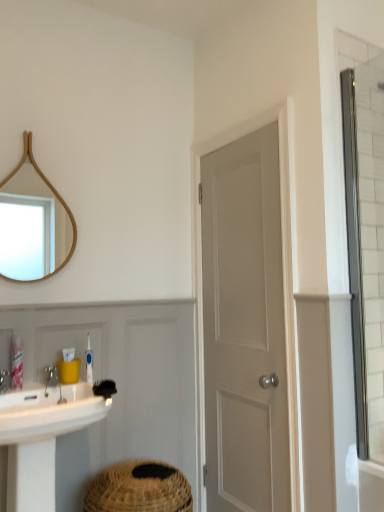
Question: From the image's perspective, is yellow plastic container at sink, the 2th toiletry from the left, located beneath white glossy sink at lower left?

Choices:
 (A) yes
 (B) no

Answer: (B)

Question: Is the position of yellow plastic container at sink, which is counted as the second toiletry, starting from the right, more distant than that of white glossy sink at lower left?

Choices:
 (A) yes
 (B) no

Answer: (A)

Question: Can you confirm if yellow plastic container at sink, the 2th toiletry from the left, is shorter than white glossy sink at lower left?

Choices:
 (A) yes
 (B) no

Answer: (A)

Question: Is yellow plastic container at sink, which is counted as the second toiletry, starting from the right, directly adjacent to white glossy sink at lower left?

Choices:
 (A) yes
 (B) no

Answer: (B)

Question: Considering the relative sizes of yellow plastic container at sink, the 2th toiletry from the left, and white glossy sink at lower left in the image provided, is yellow plastic container at sink, the 2th toiletry from the left, wider than white glossy sink at lower left?

Choices:
 (A) no
 (B) yes

Answer: (A)

Question: From the image's perspective, does yellow plastic container at sink, the 2th toiletry from the left, appear higher than white glossy sink at lower left?

Choices:
 (A) no
 (B) yes

Answer: (B)

Question: Does silver metallic faucet at lower left have a larger size compared to black bristle brush at lower center?

Choices:
 (A) yes
 (B) no

Answer: (B)

Question: Considering the relative positions of silver metallic faucet at lower left and black bristle brush at lower center in the image provided, is silver metallic faucet at lower left to the right of black bristle brush at lower center from the viewer's perspective?

Choices:
 (A) no
 (B) yes

Answer: (A)

Question: Does silver metallic faucet at lower left have a greater width compared to black bristle brush at lower center?

Choices:
 (A) yes
 (B) no

Answer: (B)

Question: Is silver metallic faucet at lower left behind black bristle brush at lower center?

Choices:
 (A) yes
 (B) no

Answer: (A)

Question: From the image's perspective, is silver metallic faucet at lower left over black bristle brush at lower center?

Choices:
 (A) yes
 (B) no

Answer: (A)

Question: Is silver metallic faucet at lower left facing away from black bristle brush at lower center?

Choices:
 (A) no
 (B) yes

Answer: (A)

Question: Is clear glass shower door at right bigger than blue plastic toothbrush at lower left, acting as the third toiletry starting from the left?

Choices:
 (A) yes
 (B) no

Answer: (A)